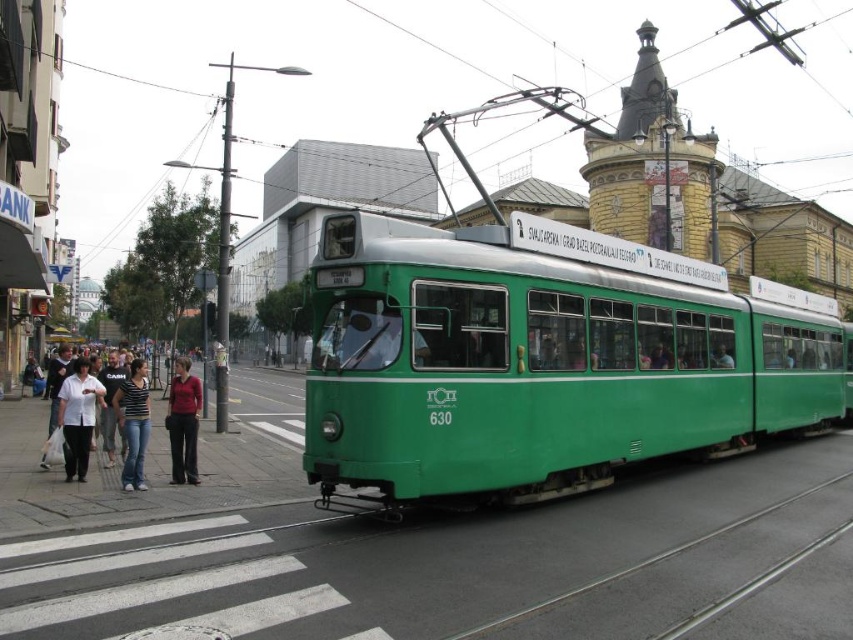
You are standing at the point labeled as point [78,417] in the image. What object is located at that point?

The point [78,417] corresponds to the white cotton shirt at lower left.

You are a delivery person carrying a package that requires a 3 meter clearance to pass through a narrow alley. You need to go from the white cotton shirt at lower left to the matte red shirt at center. Can you pass through the space between them?

The distance between the white cotton shirt at lower left and the matte red shirt at center is 2.69 meters. Since the required clearance is 3 meters, the delivery person cannot pass through the space between them.